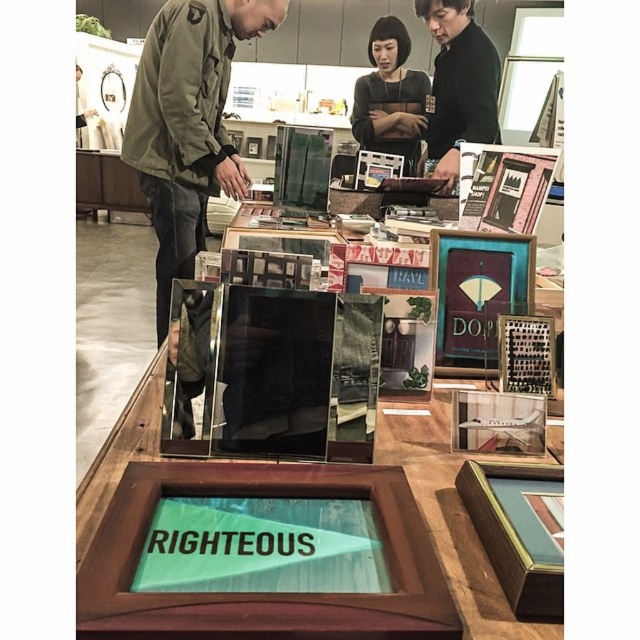
Question: Can you confirm if black matte jacket at upper center is smaller than black mesh top at center?

Choices:
 (A) yes
 (B) no

Answer: (A)

Question: Where is green matte jacket at center located in relation to black mesh top at center in the image?

Choices:
 (A) left
 (B) right

Answer: (A)

Question: Among these objects, which one is farthest from the camera?

Choices:
 (A) green matte jacket at center
 (B) black matte jacket at upper center

Answer: (B)

Question: Which point is farther to the camera?

Choices:
 (A) (172, 170)
 (B) (392, 115)

Answer: (B)

Question: Does green matte jacket at center have a smaller size compared to black matte jacket at upper center?

Choices:
 (A) yes
 (B) no

Answer: (B)

Question: Which is farther from the black matte jacket at upper center?

Choices:
 (A) black mesh top at center
 (B) green matte jacket at center

Answer: (B)